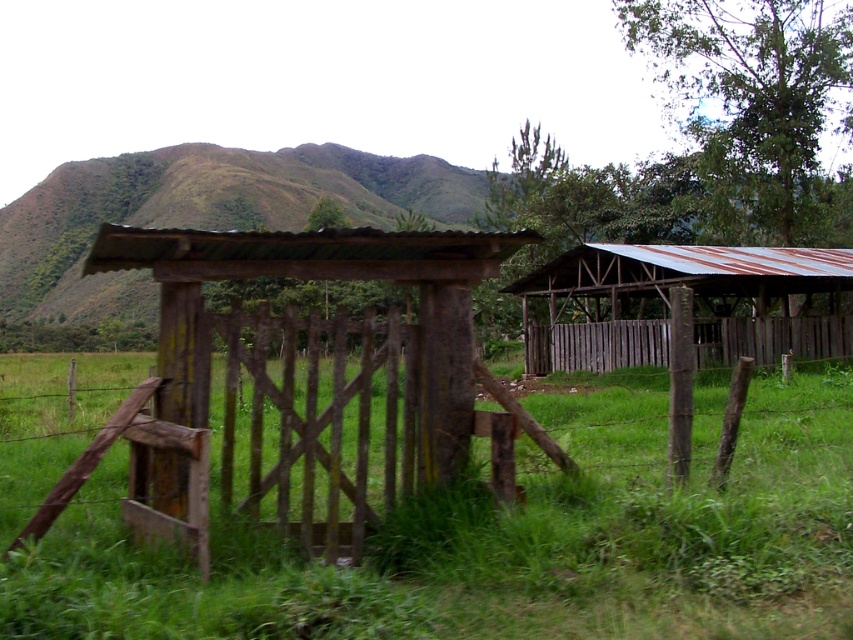
Question: Does green grassy at center lie behind weathered wood gate at center?

Choices:
 (A) no
 (B) yes

Answer: (A)

Question: Where is green grassy at center located in relation to rusty corrugated metal barn at right in the image?

Choices:
 (A) above
 (B) below

Answer: (B)

Question: Which point is farther to the camera?

Choices:
 (A) (357, 276)
 (B) (848, 330)

Answer: (B)

Question: Which object is positioned closest to the weathered wood gate at center?

Choices:
 (A) green grassy at center
 (B) rusty corrugated metal barn at right

Answer: (A)

Question: Is rusty corrugated metal barn at right closer to the viewer compared to weathered wood fence at center-right?

Choices:
 (A) yes
 (B) no

Answer: (A)

Question: Among these objects, which one is farthest from the camera?

Choices:
 (A) weathered wood gate at center
 (B) weathered wood fence at center-right
 (C) rusty corrugated metal barn at right

Answer: (B)